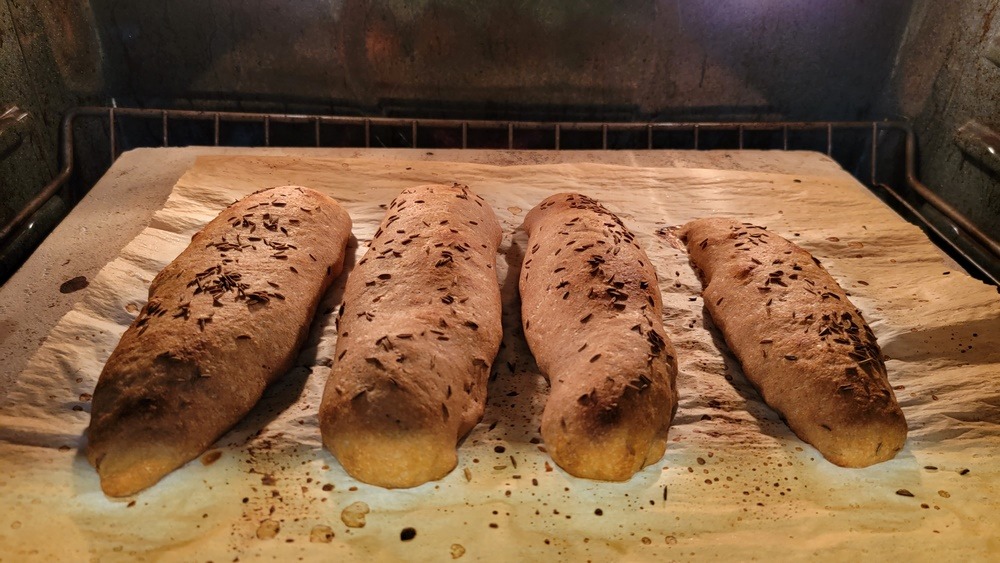
Locate an element on the screen. Image resolution: width=1000 pixels, height=563 pixels. right wall of oven is located at coordinates (973, 166).